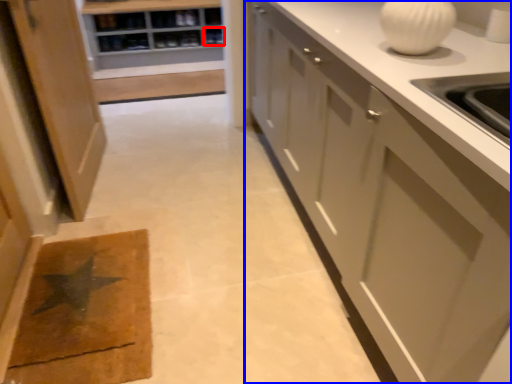
Question: Which object is further to the camera taking this photo, shelf (highlighted by a red box) or cabinetry (highlighted by a blue box)?

Choices:
 (A) shelf
 (B) cabinetry

Answer: (A)